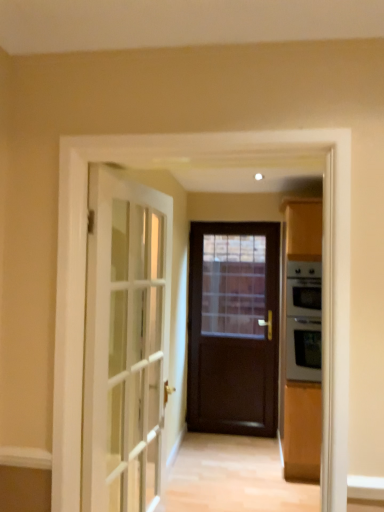
The height and width of the screenshot is (512, 384). Find the location of `vacant area that is in front of dark wood door at center, which ranks as the first door in right-to-left order`. vacant area that is in front of dark wood door at center, which ranks as the first door in right-to-left order is located at coordinates (232, 456).